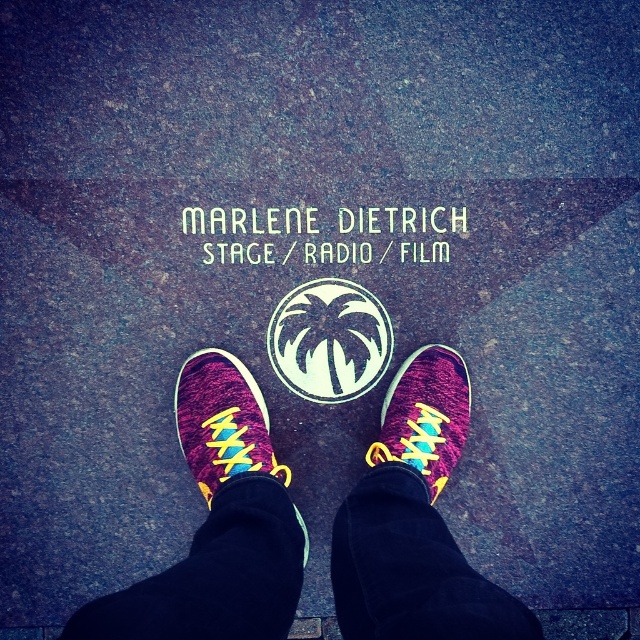
Question: Which object is positioned closest to the whitematerial/texturetext at center?

Choices:
 (A) knit fabric sneaker at center
 (B) knitted sneakers at center

Answer: (A)

Question: Considering the real-world distances, which object is farthest from the knit fabric sneaker at center?

Choices:
 (A) knitted sneakers at center
 (B) whitematerial/texturetext at center

Answer: (B)

Question: Is knitted suede sneaker at center smaller than knit fabric sneaker at center?

Choices:
 (A) yes
 (B) no

Answer: (B)

Question: Among these objects, which one is farthest from the camera?

Choices:
 (A) knitted sneakers at center
 (B) knit fabric sneaker at center
 (C) knitted suede sneaker at center

Answer: (B)

Question: Does knit fabric sneaker at center appear under whitematerial/texturetext at center?

Choices:
 (A) yes
 (B) no

Answer: (A)

Question: Can you confirm if knitted suede sneaker at center is positioned to the right of knit fabric sneaker at center?

Choices:
 (A) no
 (B) yes

Answer: (A)